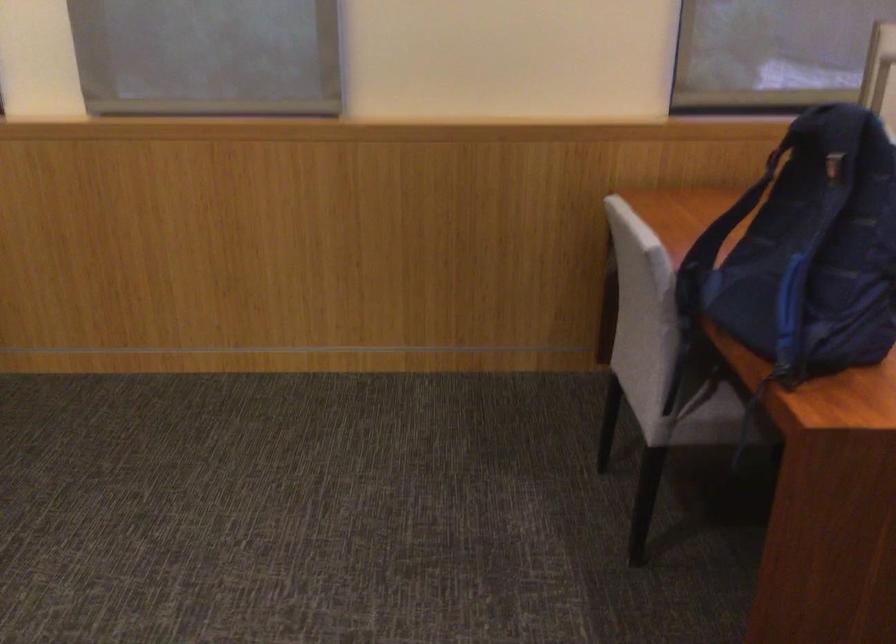
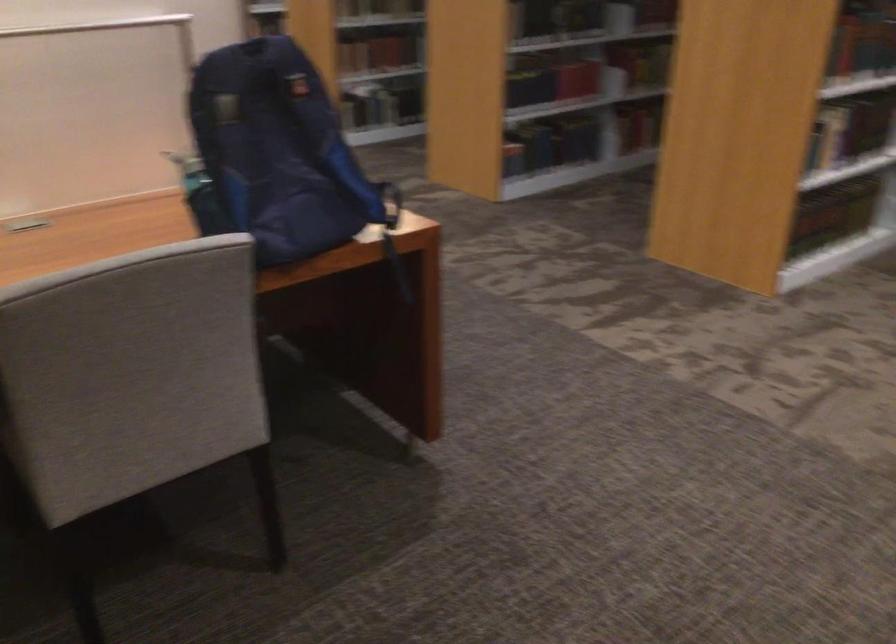
Find the pixel in the second image that matches point (755, 234) in the first image.

(200, 194)